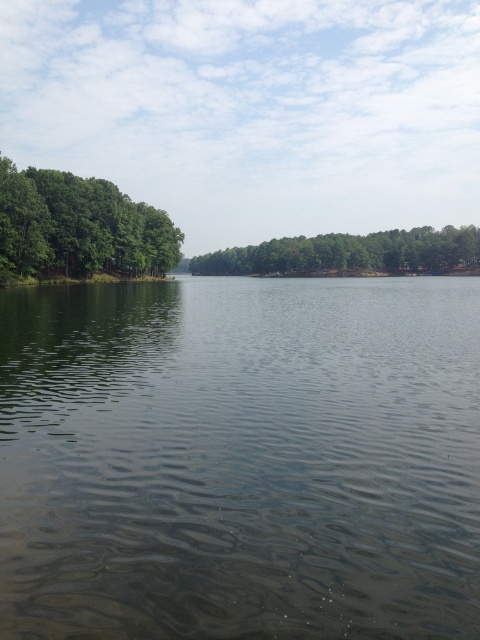
Question: Among these points, which one is farthest from the camera?

Choices:
 (A) (36, 170)
 (B) (446, 240)

Answer: (B)

Question: Where is clear water at center located in relation to green matte trees at center in the image?

Choices:
 (A) above
 (B) below

Answer: (B)

Question: From the image, what is the correct spatial relationship of clear water at center in relation to green leafy trees at left?

Choices:
 (A) above
 (B) below

Answer: (B)

Question: Estimate the real-world distances between objects in this image. Which object is closer to the green leafy trees at left?

Choices:
 (A) green matte trees at center
 (B) clear water at center

Answer: (B)

Question: Is green leafy trees at left to the right of green matte trees at center from the viewer's perspective?

Choices:
 (A) no
 (B) yes

Answer: (A)

Question: Which point is farther to the camera?

Choices:
 (A) (24, 195)
 (B) (374, 374)
 (C) (358, 236)

Answer: (C)